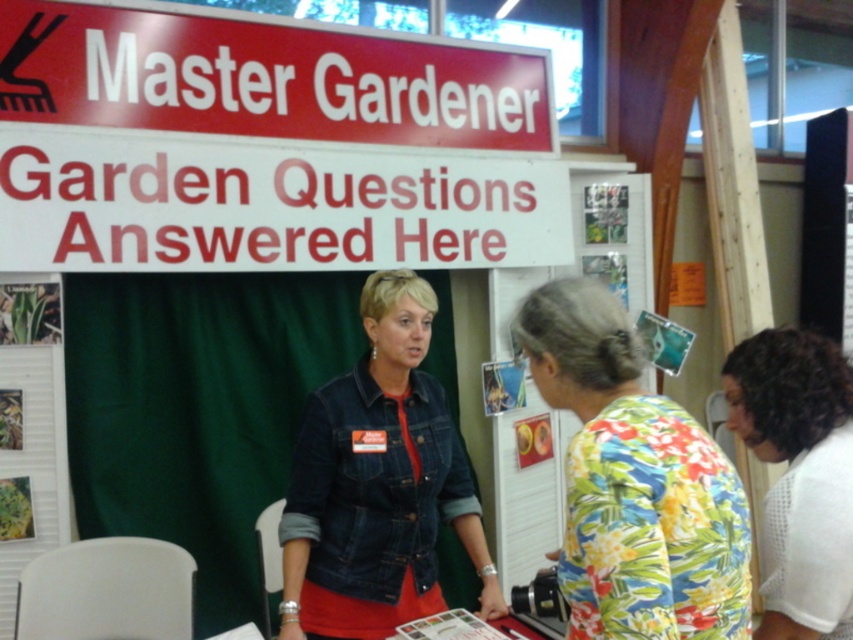
You are setting up a booth for a community event and need to place the floral fabric bulletin board at center and the green matte plant at center. The booth has limited space, and the minimum distance required between any two items is 5 feet. Can you place both items within the booth without violating the spacing rule?

The floral fabric bulletin board at center and green matte plant at center are 6.05 feet apart from each other, which exceeds the minimum required distance of 5 feet. Therefore, they can be placed within the booth without violating the spacing rule.

You are a visitor at the fair and want to read the white plastic sign at upper center but are currently standing behind the denim jacket at center. Can you see the sign?

The white plastic sign at upper center is above the denim jacket at center, so yes, you can see it as long as you can look over the denim jacket at center.